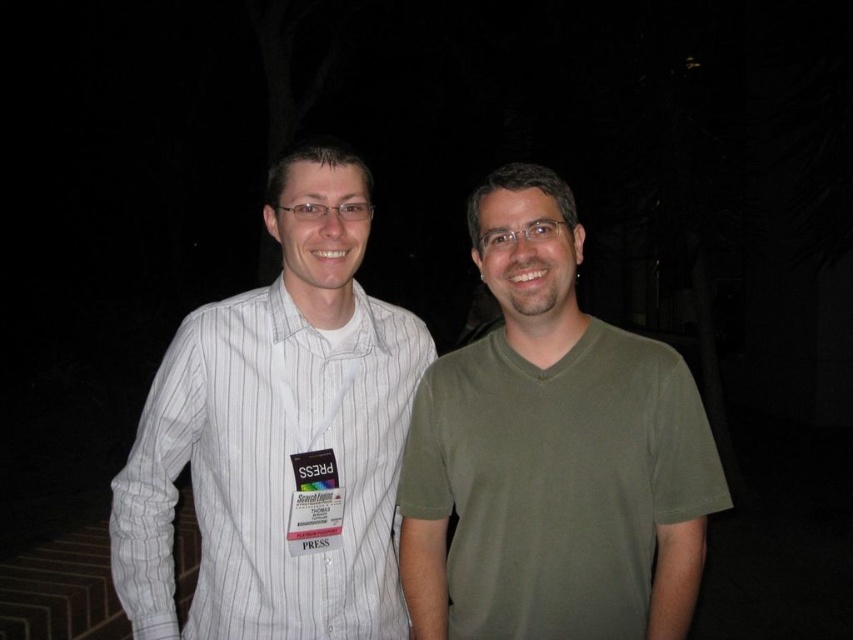
You are standing in a dark park at night and see a point marked at coordinates (552, 452). Based on the scene description, what object is located at that point?

The point at coordinates (552, 452) corresponds to the green matte tshirt at center.